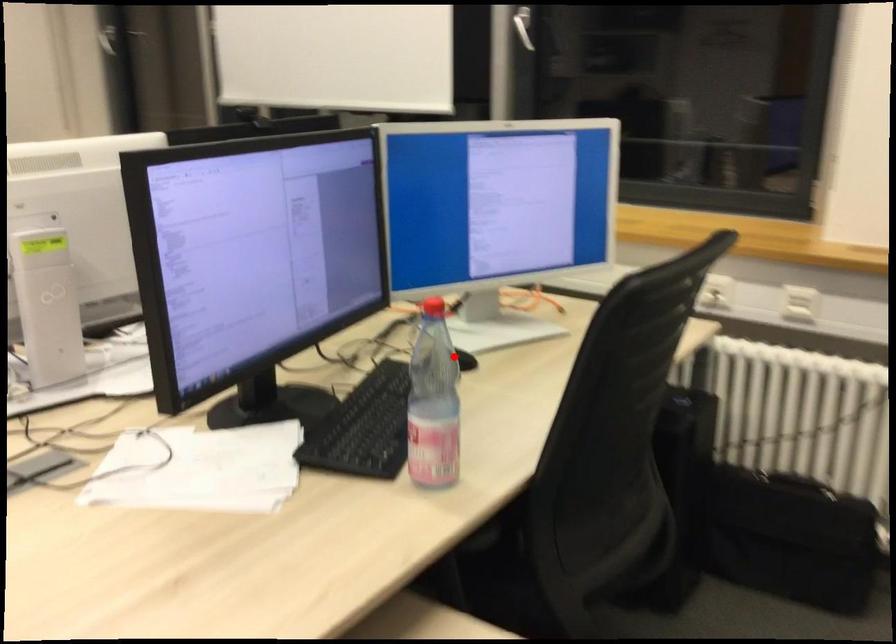
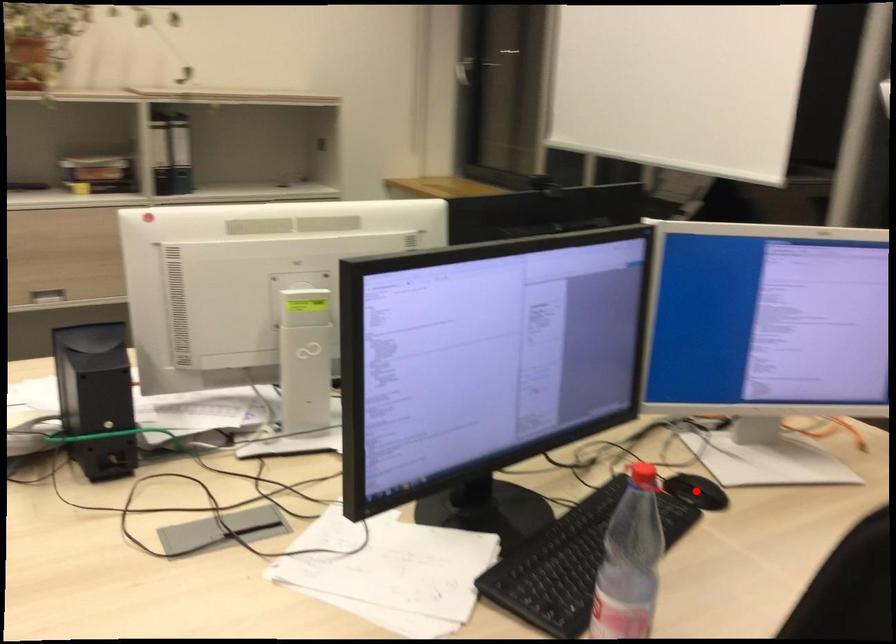
I am providing you with two images of the same scene from different viewpoints. A red point is marked on the first image and another point is marked on the second image. Do the highlighted points in image1 and image2 indicate the same real-world spot?

Yes